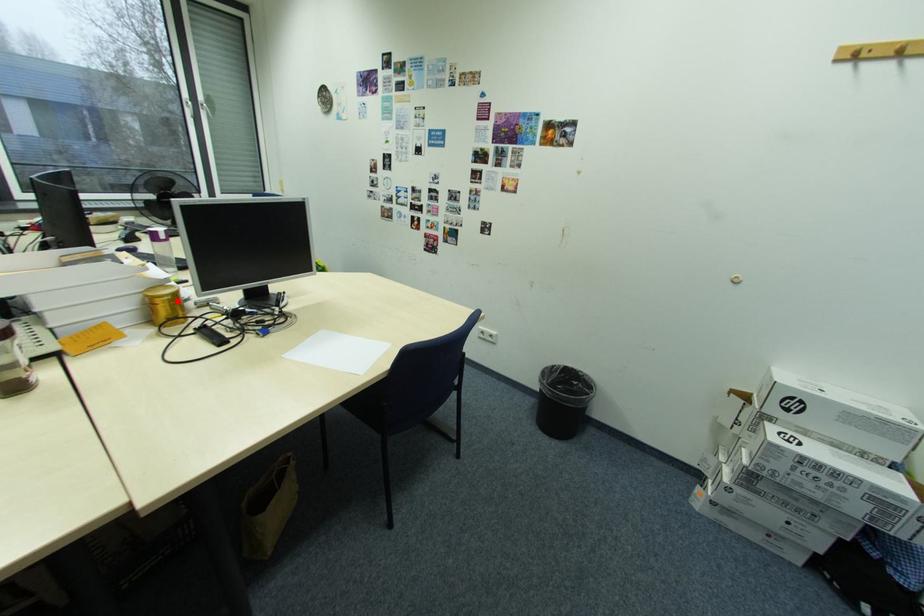
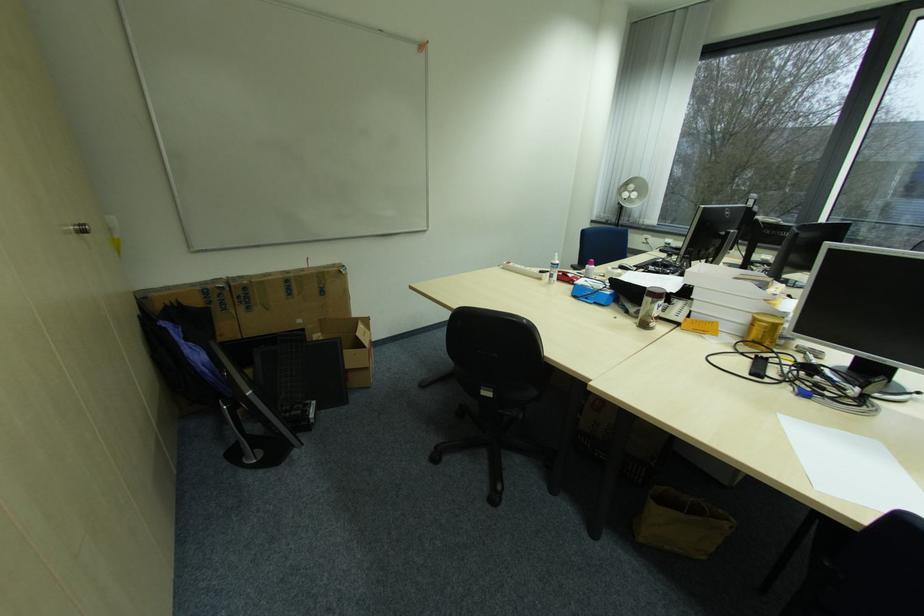
Locate, in the second image, the point that corresponds to the highlighted location in the first image.

(773, 329)